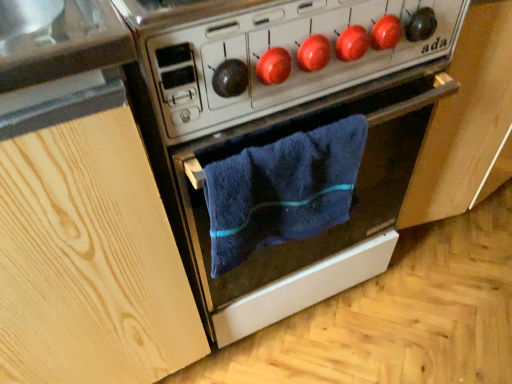
Image resolution: width=512 pixels, height=384 pixels. In order to click on vacant region above blue soft towel at center (from a real-world perspective) in this screenshot , I will do `click(276, 143)`.